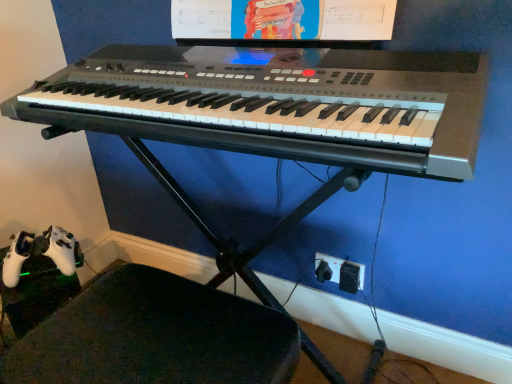
Question: Is black leather swivel chair at lower left outside matte plastic computer monitor at upper center?

Choices:
 (A) no
 (B) yes

Answer: (B)

Question: Does black leather swivel chair at lower left have a smaller size compared to matte plastic computer monitor at upper center?

Choices:
 (A) yes
 (B) no

Answer: (B)

Question: Considering the relative sizes of black leather swivel chair at lower left and matte plastic computer monitor at upper center in the image provided, is black leather swivel chair at lower left shorter than matte plastic computer monitor at upper center?

Choices:
 (A) yes
 (B) no

Answer: (B)

Question: Are black leather swivel chair at lower left and matte plastic computer monitor at upper center beside each other?

Choices:
 (A) yes
 (B) no

Answer: (B)

Question: Is black leather swivel chair at lower left far away from matte plastic computer monitor at upper center?

Choices:
 (A) yes
 (B) no

Answer: (B)

Question: Is black leather swivel chair at lower left aimed at matte plastic computer monitor at upper center?

Choices:
 (A) no
 (B) yes

Answer: (A)

Question: From the image's perspective, is black plastic keyboard at center located beneath black plastic plug at lower right?

Choices:
 (A) yes
 (B) no

Answer: (B)

Question: Is black plastic keyboard at center to the right of black plastic plug at lower right from the viewer's perspective?

Choices:
 (A) yes
 (B) no

Answer: (B)

Question: Does black plastic keyboard at center come behind black plastic plug at lower right?

Choices:
 (A) no
 (B) yes

Answer: (A)

Question: Is black plastic keyboard at center oriented towards black plastic plug at lower right?

Choices:
 (A) yes
 (B) no

Answer: (B)

Question: Can you confirm if black plastic keyboard at center is thinner than black plastic plug at lower right?

Choices:
 (A) no
 (B) yes

Answer: (A)

Question: Can you confirm if black plastic keyboard at center is bigger than black plastic plug at lower right?

Choices:
 (A) yes
 (B) no

Answer: (A)

Question: Is the position of black plastic keyboard at center more distant than that of black leather swivel chair at lower left?

Choices:
 (A) no
 (B) yes

Answer: (B)